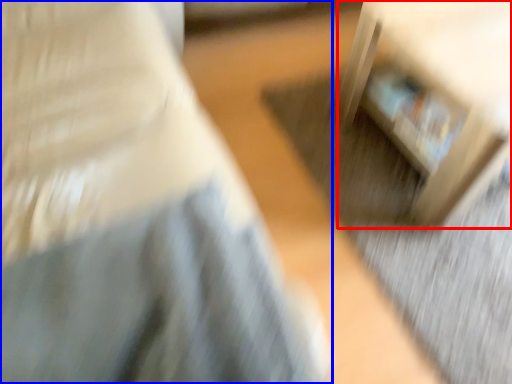
Question: Which point is further to the camera, furniture (highlighted by a red box) or furniture (highlighted by a blue box)?

Choices:
 (A) furniture
 (B) furniture

Answer: (A)